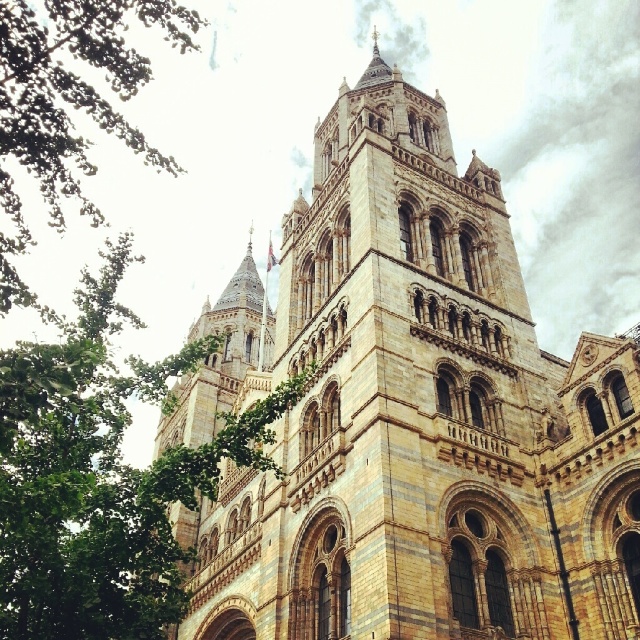
You are an architect visiting a historic site and see the brown stone church at center and the green leafy tree at left. Which structure appears larger in the image?

The brown stone church at center appears larger than the green leafy tree at left in the image.

You are standing at the entrance of the brown stone church at center. Looking towards the spire, which direction should you walk to reach the spire?

The spire is part of the brown stone church at center, so you are already facing it. Walk straight ahead to reach the spire.

You are standing in front of the grand historic building and notice a point marked at coordinates (100, 476). Based on the scene, which object does this point belong to?

The point at coordinates (100, 476) is located on the green leafy tree at left.